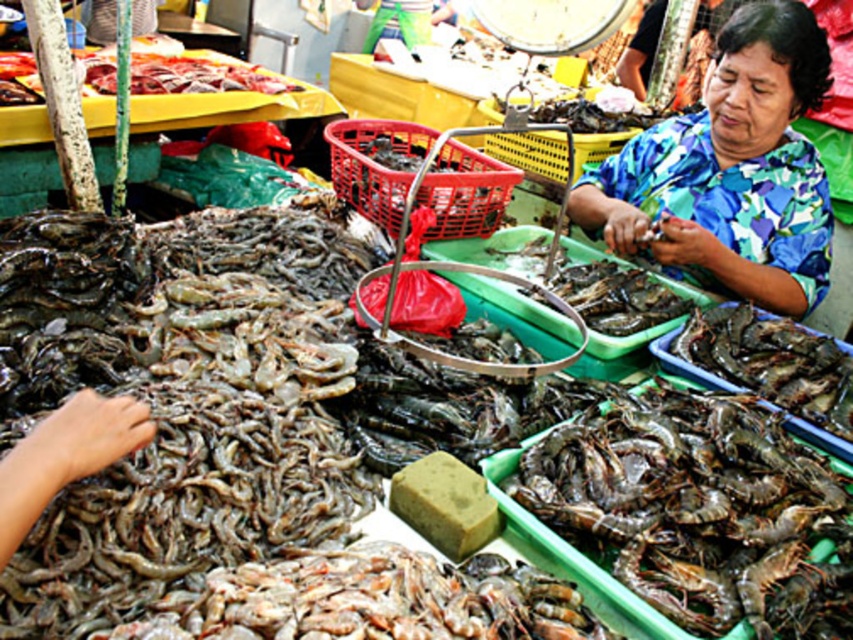
Question: Which of the following is the farthest from the observer?

Choices:
 (A) (221, 90)
 (B) (573, 516)
 (C) (766, 170)

Answer: (A)

Question: Does blue floral shirt at upper right appear on the right side of raw meat at upper left?

Choices:
 (A) yes
 (B) no

Answer: (A)

Question: Which point is closer to the camera?

Choices:
 (A) raw meat at upper left
 (B) blue floral shirt at upper right

Answer: (B)

Question: Is blue floral shirt at upper right further to the viewer compared to raw meat at upper left?

Choices:
 (A) no
 (B) yes

Answer: (A)

Question: Can you confirm if gray matte shrimp at lower center is positioned to the left of blue floral shirt at upper right?

Choices:
 (A) no
 (B) yes

Answer: (B)

Question: Which point is closer to the camera?

Choices:
 (A) (107, 60)
 (B) (605, 214)

Answer: (B)